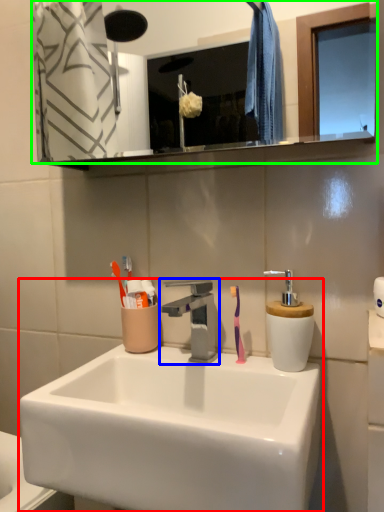
Question: Estimate the real-world distances between objects in this image. Which object is farther from sink (highlighted by a red box), tap (highlighted by a blue box) or mirror (highlighted by a green box)?

Choices:
 (A) tap
 (B) mirror

Answer: (B)